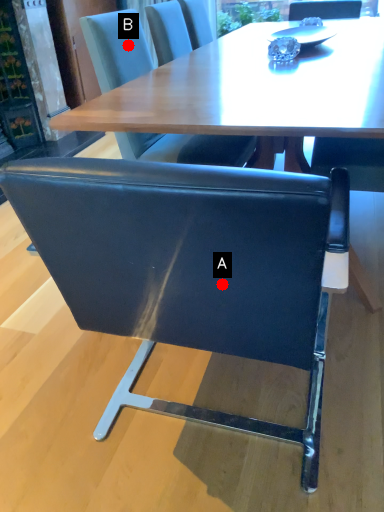
Question: Two points are circled on the image, labeled by A and B beside each circle. Among these points, which one is farthest from the camera?

Choices:
 (A) A is further
 (B) B is further

Answer: (B)